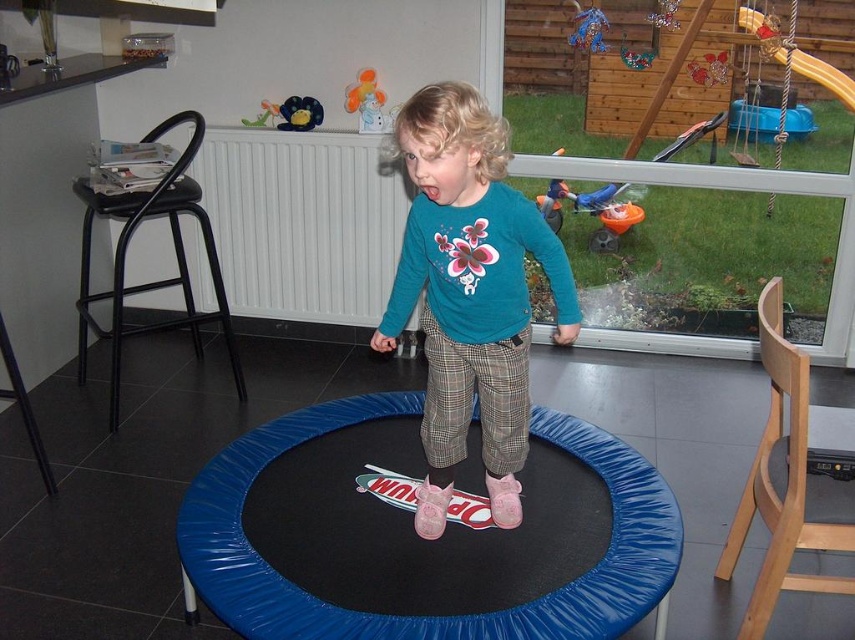
You are a photographer setting up for a photo shoot in the room with the teal fabric shirt at center and the matte plastic toy at upper center. You want to ensure the toy is visible in the background behind the shirt. Is the current arrangement suitable for this?

The teal fabric shirt at center is in front of the matte plastic toy at upper center, so the toy will be partially or fully obscured in the background. Adjust the positions to place the shirt behind the toy or move the toy further back to ensure visibility.

You are standing at the point labeled point (263, 99) and want to walk to the point labeled point (481, 317). Based on the scene description, will you need to walk towards the trampoline or away from it?

Point (481, 317) is in front of point (263, 99), so you will need to walk towards the trampoline.